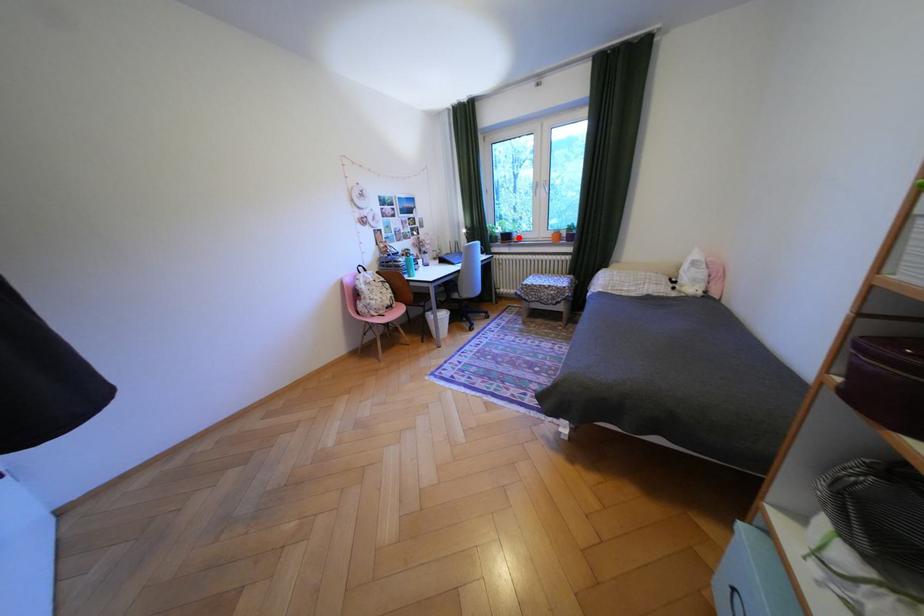
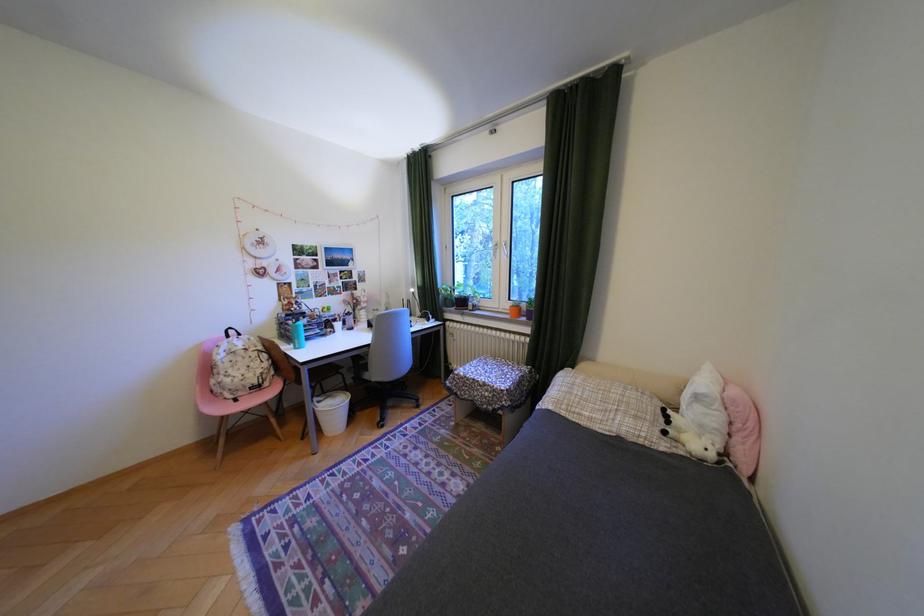
In the second image, find the point that corresponds to the highlighted location in the first image.

(475, 302)